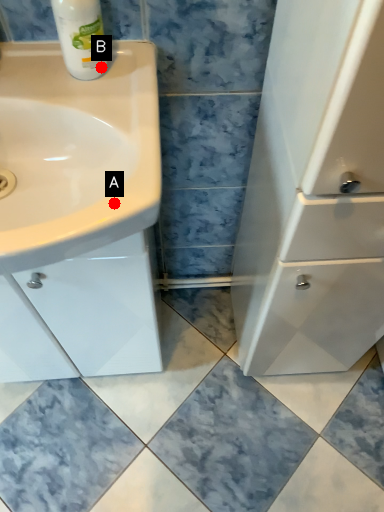
Question: Two points are circled on the image, labeled by A and B beside each circle. Which of the following is the farthest from the observer?

Choices:
 (A) A is further
 (B) B is further

Answer: (B)